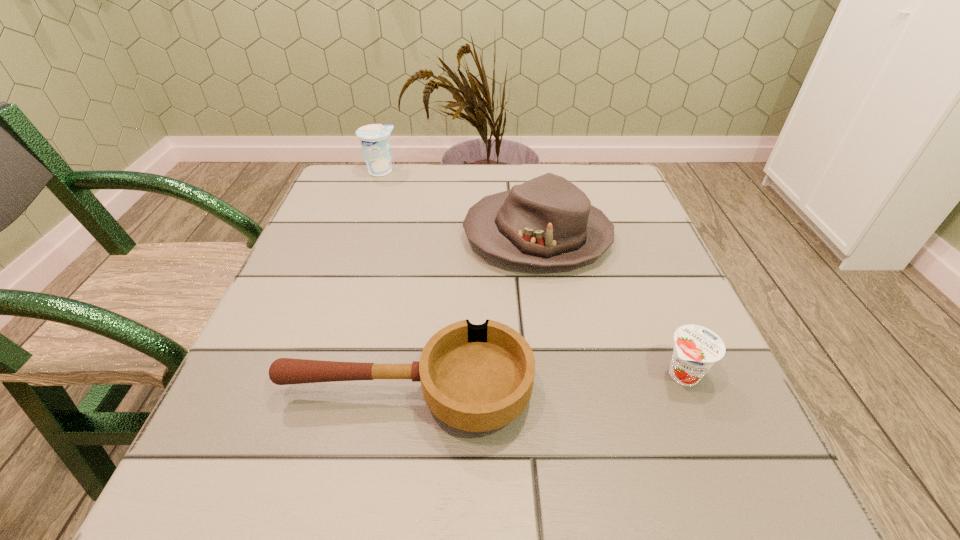
I want to click on vacant position located on the left of the right yogurt, so click(x=569, y=374).

Find the location of a particular element. This screenshot has height=540, width=960. hat that is at the far edge is located at coordinates (547, 221).

Identify the location of yogurt present at the far edge. (375, 138).

Where is `yogurt that is positioned at the left edge`? yogurt that is positioned at the left edge is located at coordinates (375, 138).

I want to click on saucepan that is positioned at the left edge, so click(477, 378).

You are a GUI agent. You are given a task and a screenshot of the screen. Output one action in this format:
    pyautogui.click(x=<x>, y=<y>)
    Task: Click on the hat that is at the right edge
    This screenshot has height=540, width=960.
    Given the screenshot: What is the action you would take?
    pyautogui.click(x=547, y=221)

Where is `yogurt at the right edge`? Image resolution: width=960 pixels, height=540 pixels. yogurt at the right edge is located at coordinates (696, 349).

Locate an element on the screen. Image resolution: width=960 pixels, height=540 pixels. object at the far left corner is located at coordinates (375, 138).

This screenshot has height=540, width=960. Find the location of `object that is at the far right corner`. object that is at the far right corner is located at coordinates (547, 221).

The height and width of the screenshot is (540, 960). In the image, there is a desktop. Find the location of `vacant space at the near edge`. vacant space at the near edge is located at coordinates (555, 454).